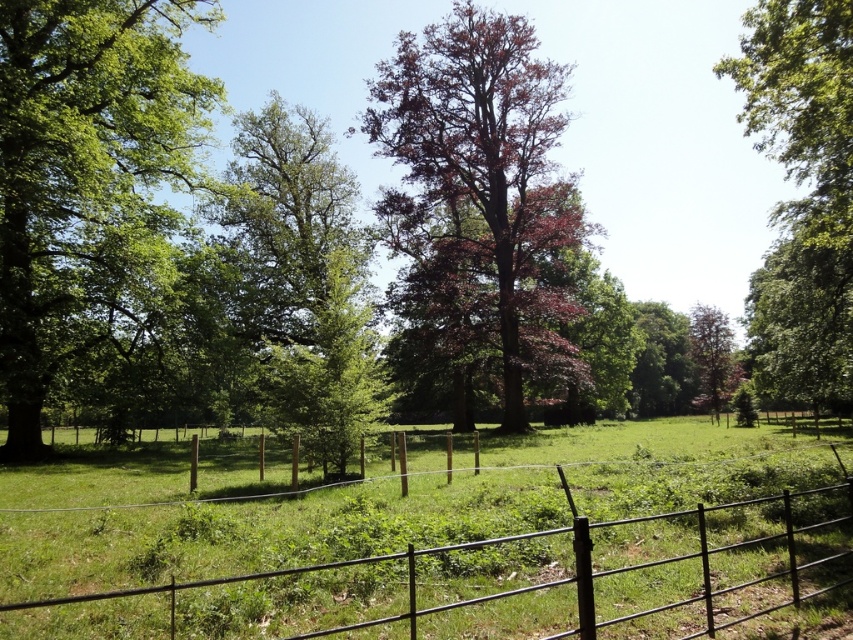
Can you confirm if green leafy tree at center is taller than purple-leaved tree at right?

Incorrect, green leafy tree at center's height is not larger of purple-leaved tree at right's.

Is point (308, 333) less distant than point (712, 307)?

Yes, it is in front of point (712, 307).

Is point (328, 342) less distant than point (694, 358)?

Yes, point (328, 342) is closer to viewer.

The image size is (853, 640). I want to click on green leafy tree at center, so click(329, 369).

Does point (664, 582) come farther from viewer compared to point (503, 22)?

No, it is in front of (503, 22).

Identify the location of black metal fence at lower center. (497, 579).

Does purple-leaved tree at center have a greater width compared to green leafy tree at center?

Yes, purple-leaved tree at center is wider than green leafy tree at center.

Is purple-leaved tree at center thinner than green leafy tree at center?

No, purple-leaved tree at center is not thinner than green leafy tree at center.

Which is in front, point (540, 339) or point (344, 346)?

Point (344, 346) is more forward.

Locate an element on the screen. The width and height of the screenshot is (853, 640). purple-leaved tree at center is located at coordinates (480, 182).